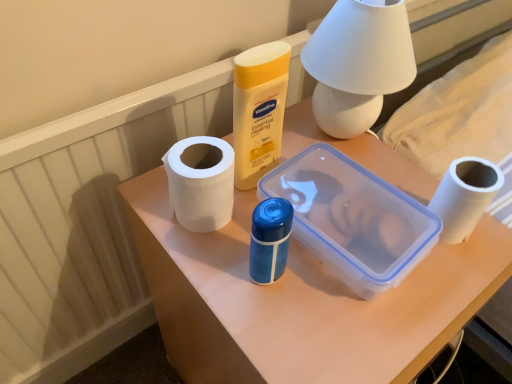
Identify the location of free space in front of white matte paper towel at center-left. (243, 292).